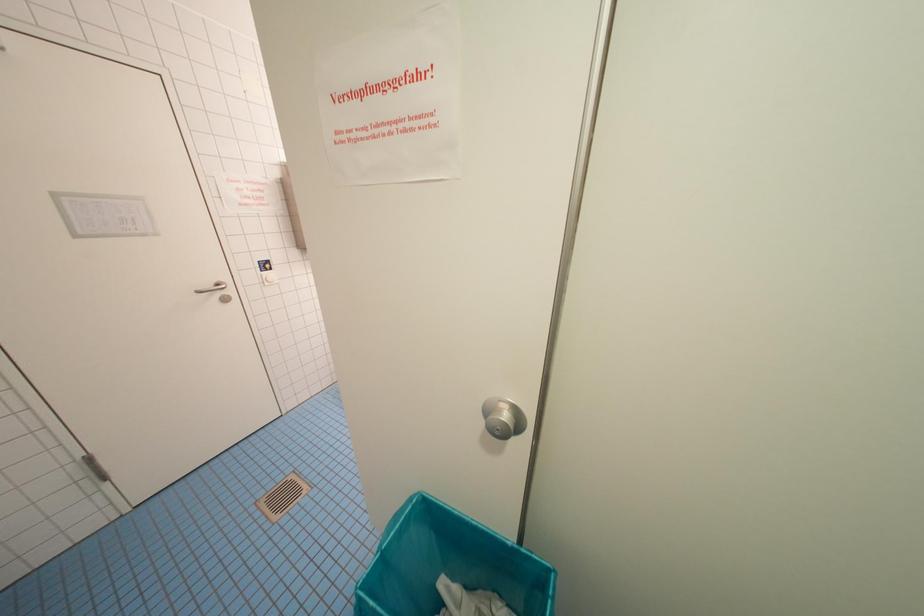
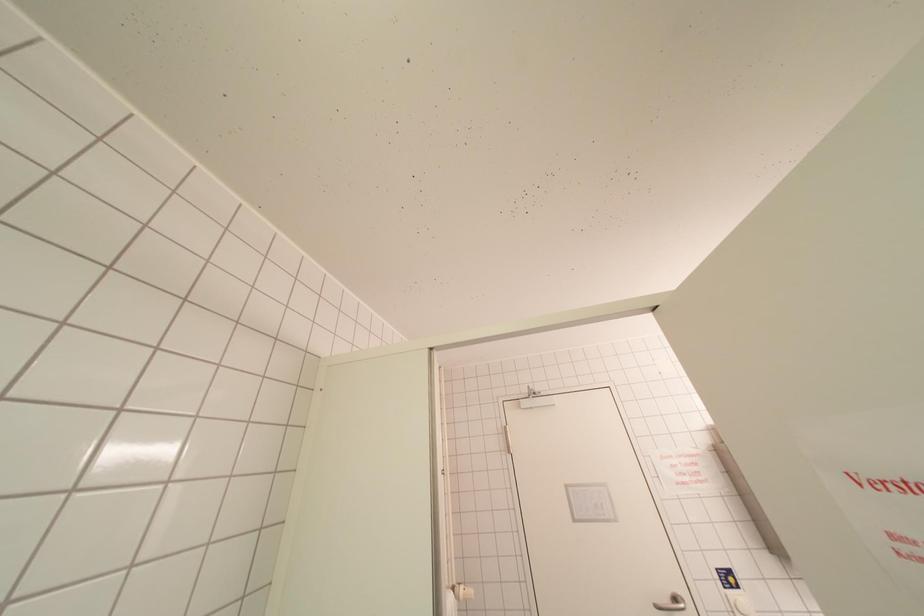
The first image is from the beginning of the video and the second image is from the end. How did the camera likely rotate when shooting the video?

The camera's rotation is toward left-up.